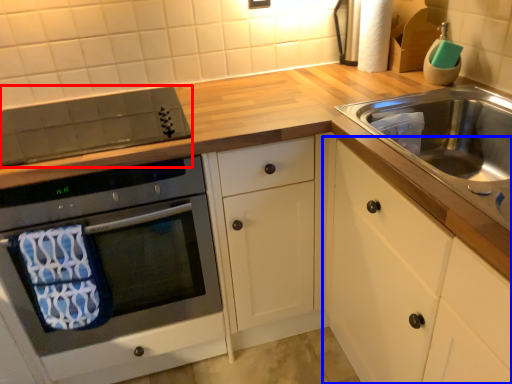
Question: Which point is further to the camera, appliance (highlighted by a red box) or cabinetry (highlighted by a blue box)?

Choices:
 (A) appliance
 (B) cabinetry

Answer: (A)